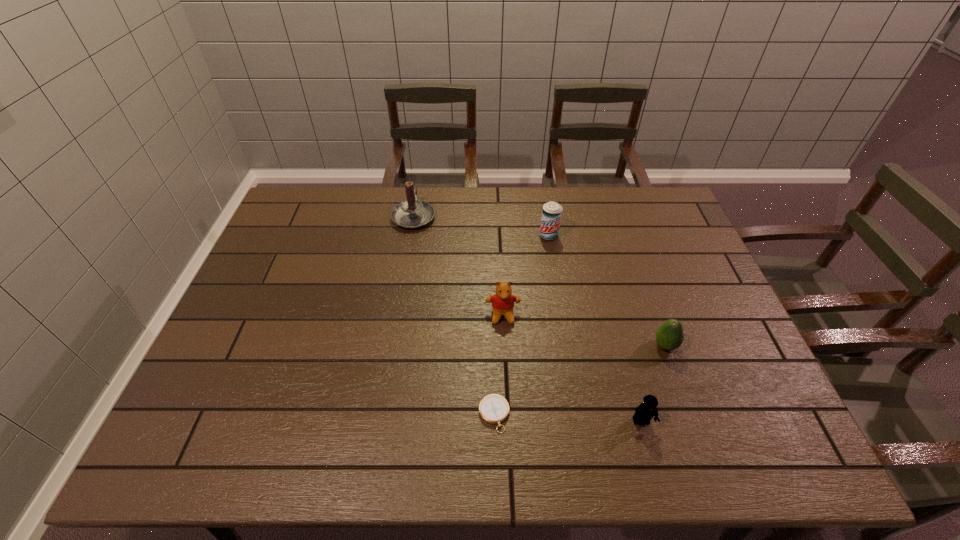
Identify the location of free space between the fourth nearest object and the leftmost object. The image size is (960, 540). (458, 266).

You are a GUI agent. You are given a task and a screenshot of the screen. Output one action in this format:
    pyautogui.click(x=<x>, y=<y>)
    Task: Click on the free spot between the fourth nearest object and the tallest object
    The image size is (960, 540).
    Given the screenshot: What is the action you would take?
    pyautogui.click(x=458, y=266)

Locate an element on the screen. This screenshot has width=960, height=540. empty location between the compass and the avocado is located at coordinates pos(580,380).

Identify the location of object that can be found as the third closest to the candle. This screenshot has height=540, width=960. (494, 409).

Find the location of a particular element. object that stands as the closest to the Lego is located at coordinates click(x=669, y=336).